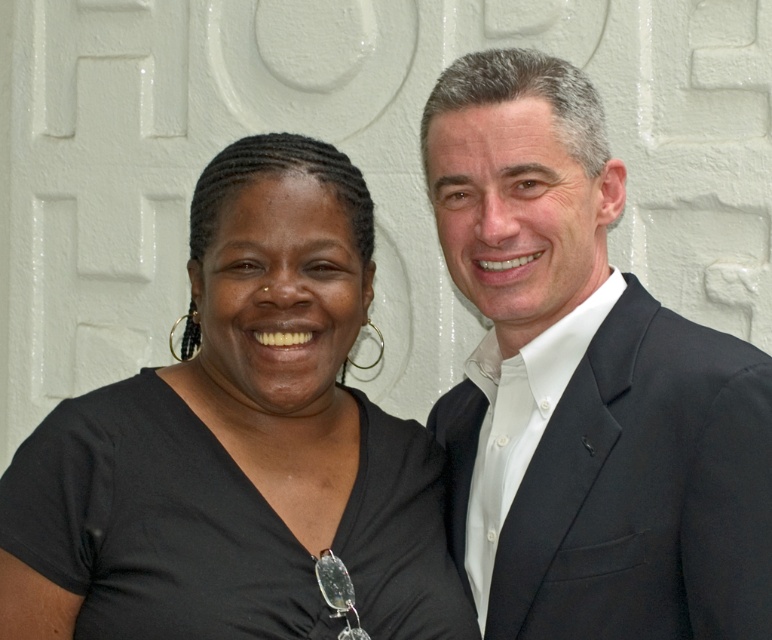
In the scene shown: You are a photographer setting up for a group photo. You need to ensure there is enough space between the black matte shirt at left and the black suit at right so that the camera can focus on both clearly. The minimum required distance for clear focus is 8 inches. Based on the scene description, is the current distance sufficient?

The black matte shirt at left and black suit at right are 8.57 inches apart, which is more than the minimum required 8 inches for clear focus. Therefore, the current distance is sufficient.